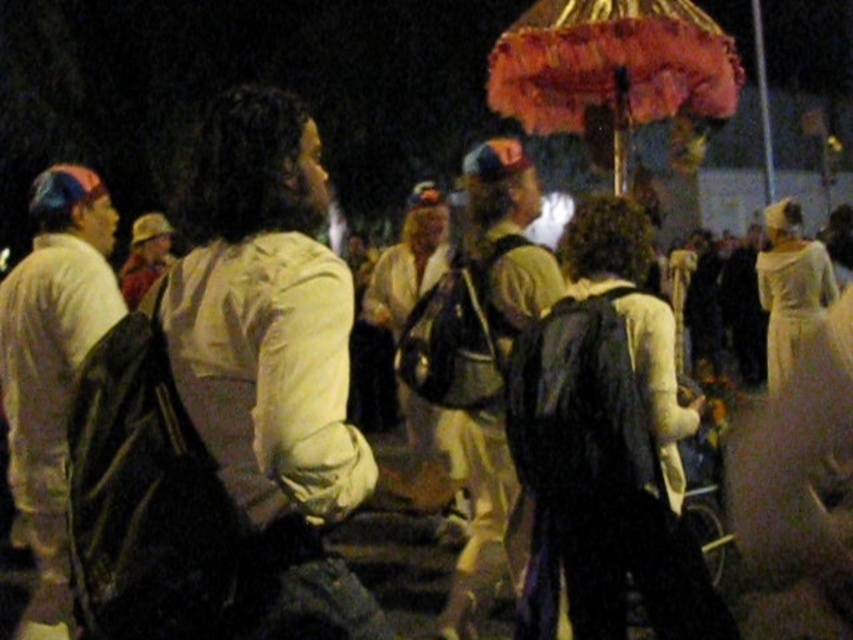
You are a photographer trying to capture a clear shot of the matte khaki shirt at center without the matte black backpack at left blocking the view. Based on their positions, can you position yourself in a way to avoid the backpack?

The matte black backpack at left might be wider than the matte khaki shirt at center, so positioning yourself directly behind the backpack might still block the view. Try moving to the side or adjusting your angle to ensure the backpack doesn

You are standing at the center of the scene and want to locate the white matte jacket at center. According to the coordinates provided, in which direction should you look to find it?

The white matte jacket at center is located at coordinates point (271, 362), so you should look slightly to the right and down from the very center of the scene.